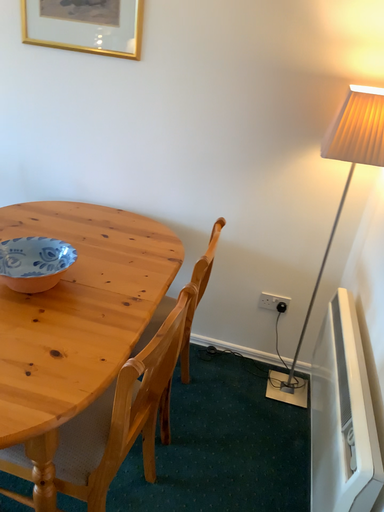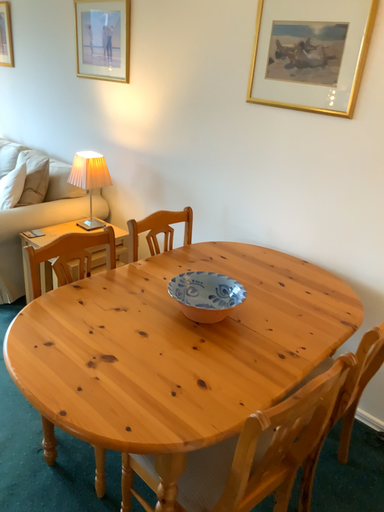
Question: How did the camera likely rotate when shooting the video?

Choices:
 (A) rotated upward
 (B) rotated downward

Answer: (A)